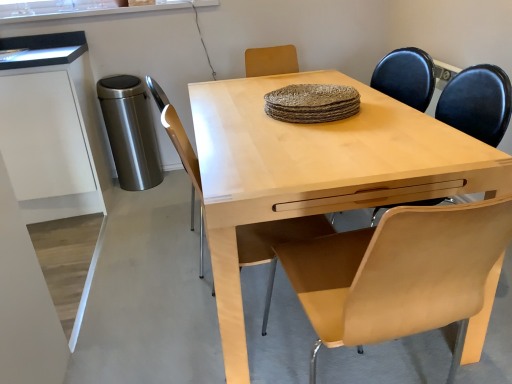
Question: Is light brown leather chair at center further to the viewer compared to light wood desk at center?

Choices:
 (A) yes
 (B) no

Answer: (A)

Question: Could you tell me if light brown leather chair at center is turned towards light wood desk at center?

Choices:
 (A) yes
 (B) no

Answer: (A)

Question: Can you confirm if light brown leather chair at center is wider than light wood desk at center?

Choices:
 (A) yes
 (B) no

Answer: (B)

Question: Does light brown leather chair at center appear on the right side of light wood desk at center?

Choices:
 (A) yes
 (B) no

Answer: (B)

Question: Is light brown leather chair at center looking in the opposite direction of light wood desk at center?

Choices:
 (A) yes
 (B) no

Answer: (A)

Question: From the image's perspective, would you say light brown leather chair at center is positioned over light wood desk at center?

Choices:
 (A) no
 (B) yes

Answer: (A)

Question: Is light wood desk at center looking in the opposite direction of light brown leather chair at center?

Choices:
 (A) no
 (B) yes

Answer: (A)

Question: Is light wood desk at center bigger than light brown leather chair at center?

Choices:
 (A) yes
 (B) no

Answer: (A)

Question: From a real-world perspective, does light wood desk at center stand above light brown leather chair at center?

Choices:
 (A) yes
 (B) no

Answer: (B)

Question: Does light wood desk at center turn towards light brown leather chair at center?

Choices:
 (A) yes
 (B) no

Answer: (A)

Question: Is light wood desk at center completely or partially outside of light brown leather chair at center?

Choices:
 (A) yes
 (B) no

Answer: (A)

Question: From the image's perspective, is light wood desk at center below light brown leather chair at center?

Choices:
 (A) no
 (B) yes

Answer: (A)

Question: Can you confirm if light wood desk at center is bigger than white matte cabinet at left?

Choices:
 (A) no
 (B) yes

Answer: (B)